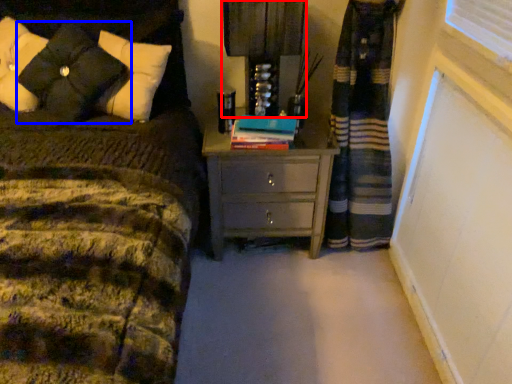
Question: Among these objects, which one is farthest to the camera, bedside lamp (highlighted by a red box) or pillow (highlighted by a blue box)?

Choices:
 (A) bedside lamp
 (B) pillow

Answer: (A)